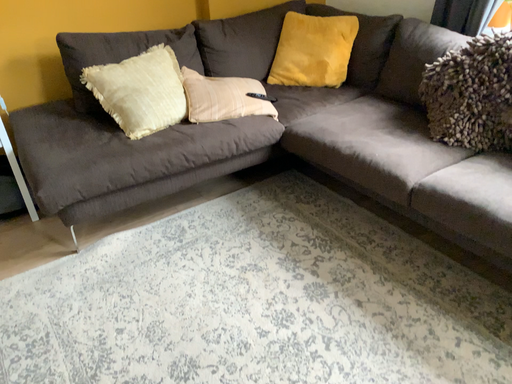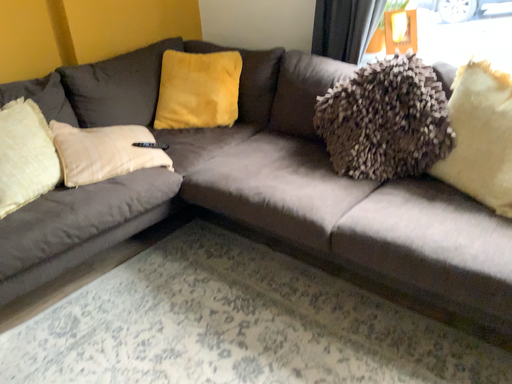
Question: Which way did the camera rotate in the video?

Choices:
 (A) rotated right
 (B) rotated left

Answer: (A)